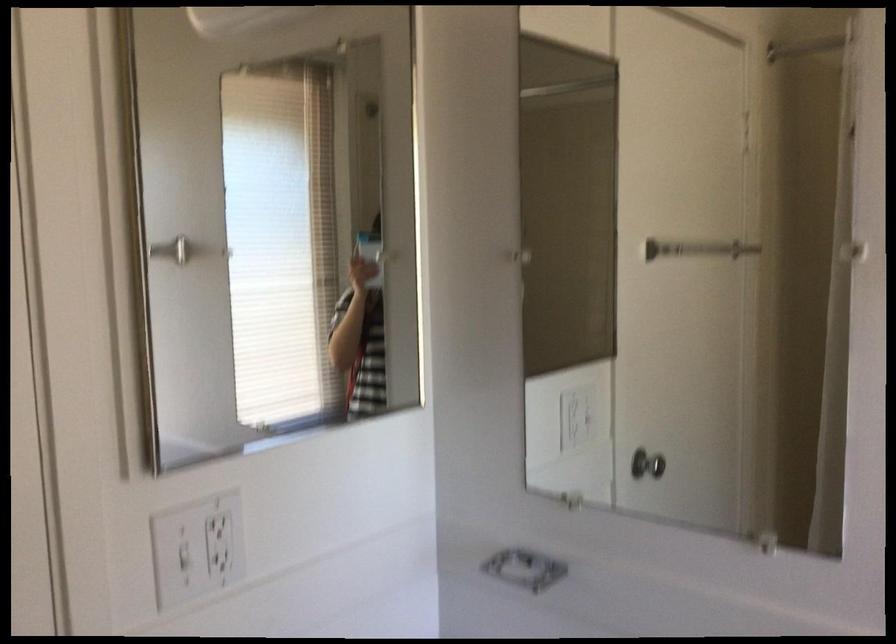
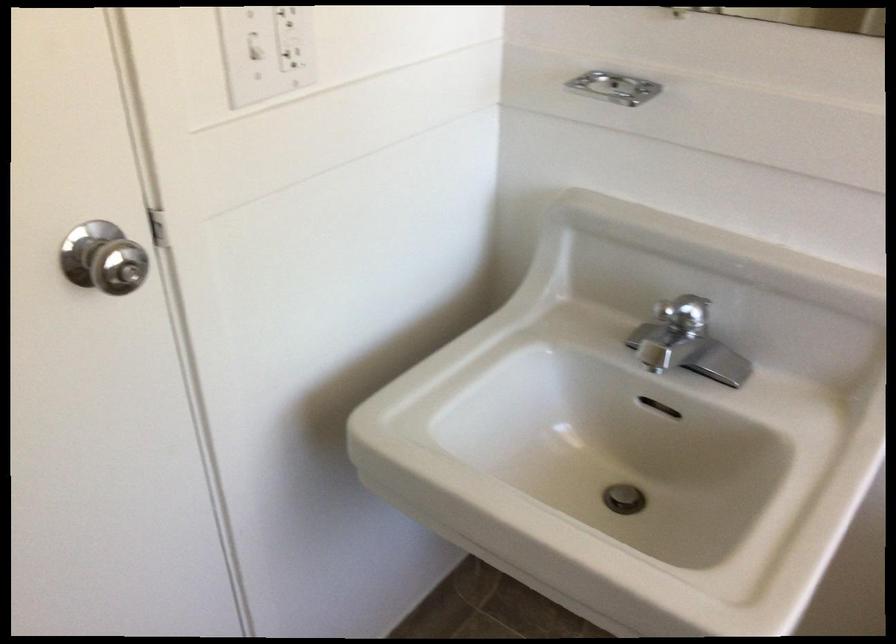
The point at (214, 567) is marked in the first image. Where is the corresponding point in the second image?

(291, 59)